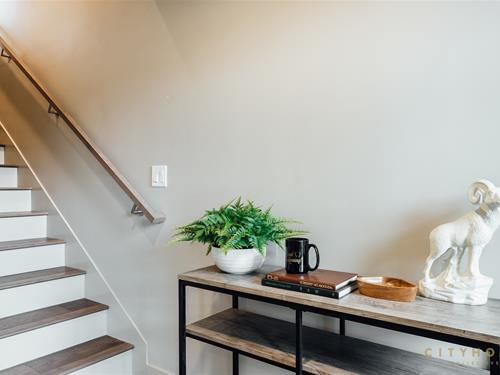
Identify the location of pot. Image resolution: width=500 pixels, height=375 pixels. (242, 259).